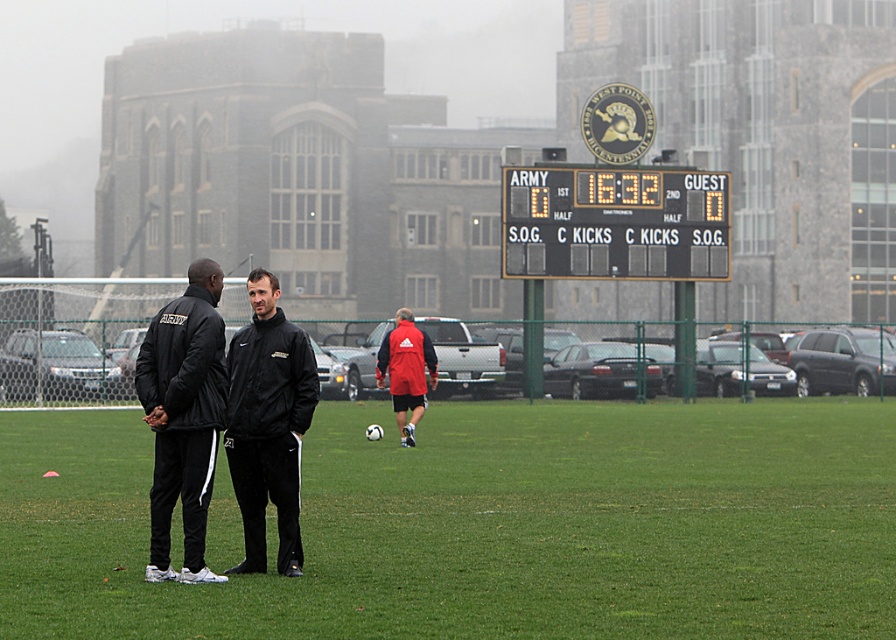
You are a spectator at the sports field. You notice the black plastic scoreboard at upper center and the black matte jacket at left. Which object appears smaller in the image?

The black plastic scoreboard at upper center appears smaller than the black matte jacket at left in the image.